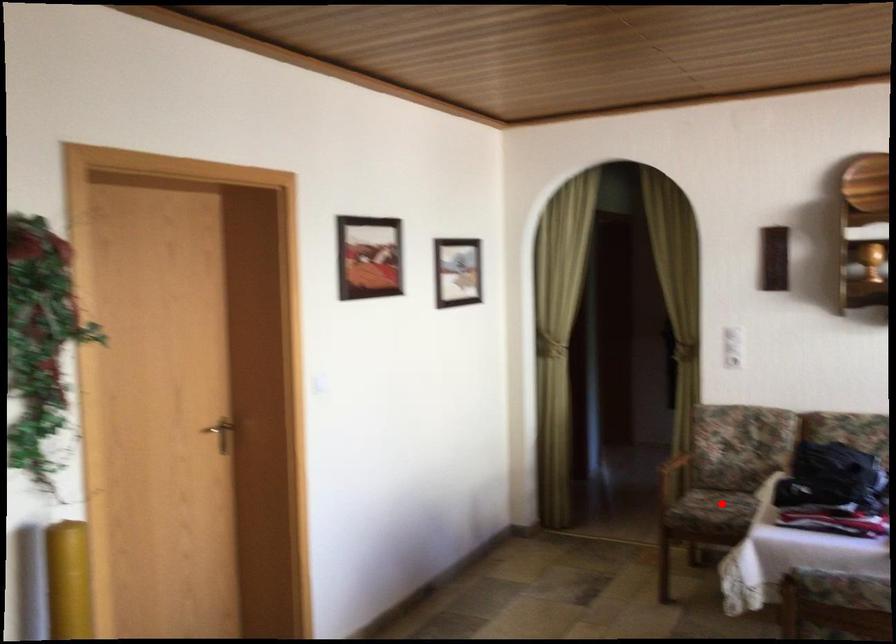
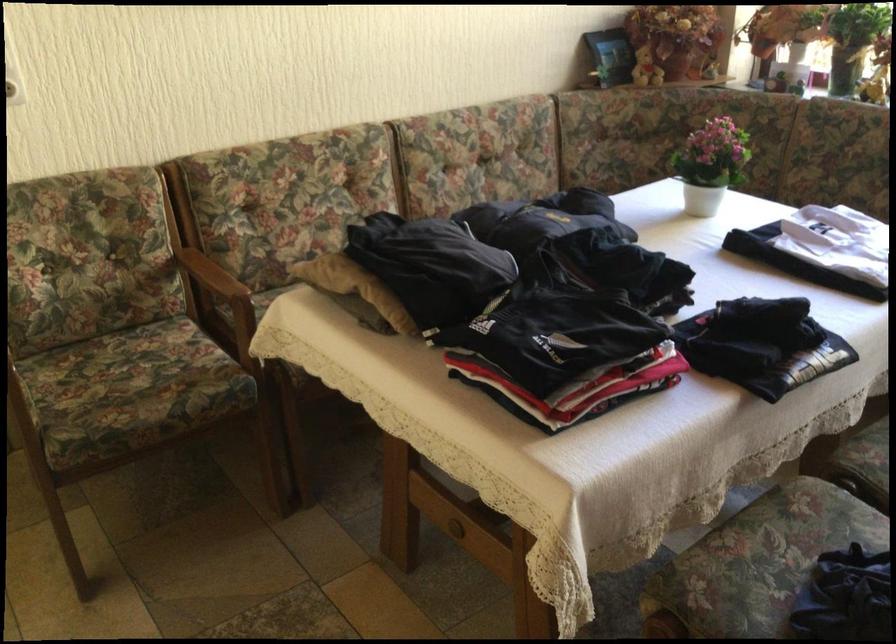
Find the pixel in the second image that matches the highlighted location in the first image.

(130, 383)